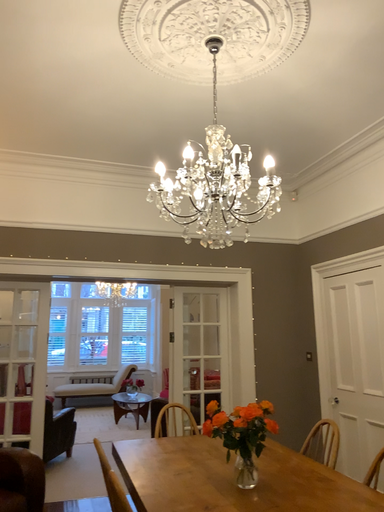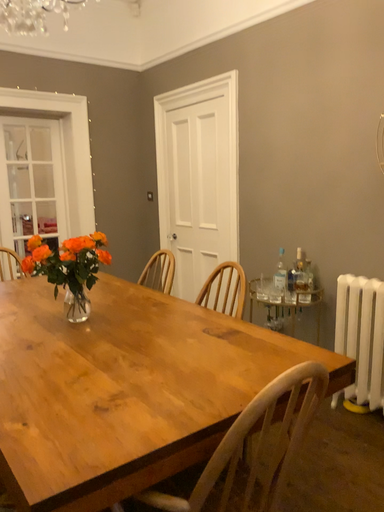
Question: Which way did the camera rotate in the video?

Choices:
 (A) rotated right
 (B) rotated left

Answer: (A)